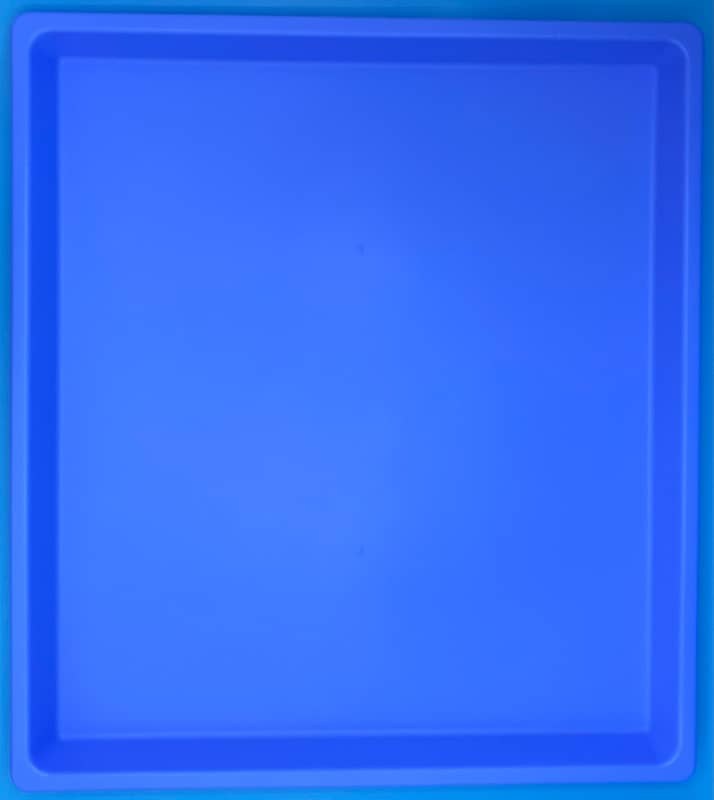
This screenshot has height=800, width=714. I want to click on top and bottom of inner tray, so click(377, 730), click(362, 62).